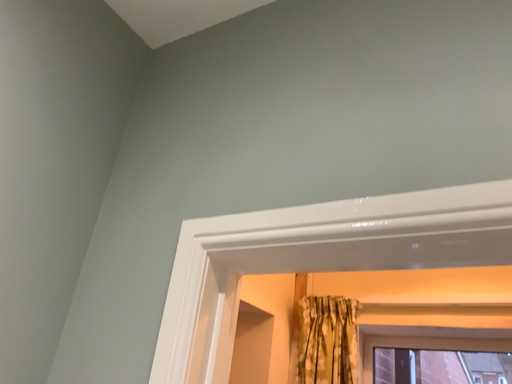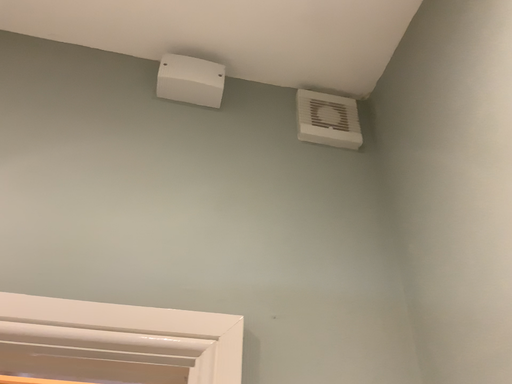
Question: How did the camera likely rotate when shooting the video?

Choices:
 (A) rotated left
 (B) rotated right

Answer: (B)